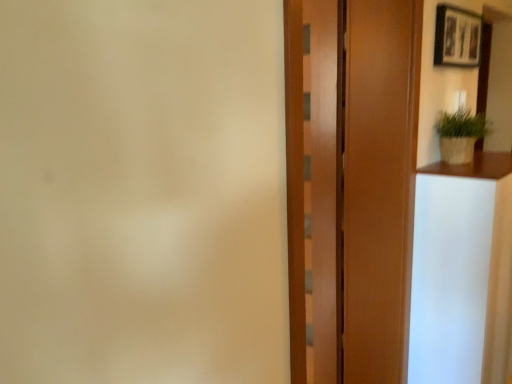
Measure the distance between point (475, 55) and camera.

They are 6.99 feet apart.

You are a GUI agent. You are given a task and a screenshot of the screen. Output one action in this format:
    pyautogui.click(x=<x>, y=<y>)
    Task: Click on the green woven basket at upper right
    This screenshot has width=512, height=384.
    Given the screenshot: What is the action you would take?
    pyautogui.click(x=460, y=135)

Describe the element at coordinates (462, 272) in the screenshot. I see `white glossy vanity at right` at that location.

Measure the distance between wooden barn door at center and camera.

wooden barn door at center is 6.10 feet away from camera.

The height and width of the screenshot is (384, 512). In order to click on wooden picture frame at upper right in this screenshot , I will do `click(457, 37)`.

Is green woven basket at upper right smaller than wooden barn door at center?

Correct, green woven basket at upper right occupies less space than wooden barn door at center.

Is green woven basket at upper right touching wooden barn door at center?

No, green woven basket at upper right is not beside wooden barn door at center.

You are a GUI agent. You are given a task and a screenshot of the screen. Output one action in this format:
    pyautogui.click(x=<x>, y=<y>)
    Task: Click on the barn door to the left of green woven basket at upper right
    The width and height of the screenshot is (512, 384).
    Given the screenshot: What is the action you would take?
    pyautogui.click(x=313, y=185)

From the image's perspective, who appears lower, wooden barn door at center or wooden picture frame at upper right?

From the image's view, wooden barn door at center is below.

Is wooden barn door at center facing towards wooden picture frame at upper right?

No.

Considering the sizes of objects wooden barn door at center and wooden picture frame at upper right in the image provided, who is thinner, wooden barn door at center or wooden picture frame at upper right?

Thinner between the two is wooden barn door at center.

From a real-world perspective, is wooden barn door at center below wooden picture frame at upper right?

Yes.

Is white glossy vanity at right completely or partially outside of wooden door at center?

Yes.

This screenshot has width=512, height=384. What are the coordinates of `vanity that is behind the wooden door at center` in the screenshot? It's located at (462, 272).

Between white glossy vanity at right and wooden door at center, which one has larger width?

With larger width is white glossy vanity at right.

Is white glossy vanity at right beside wooden door at center?

No, white glossy vanity at right is not next to wooden door at center.

Between point (484, 221) and point (474, 51), which one is positioned in front?

Point (484, 221)

Does white glossy vanity at right have a greater width compared to wooden picture frame at upper right?

Yes, white glossy vanity at right is wider than wooden picture frame at upper right.

Does white glossy vanity at right have a greater height compared to wooden picture frame at upper right?

Correct, white glossy vanity at right is much taller as wooden picture frame at upper right.

Identify the location of vanity on the right of wooden picture frame at upper right. The image size is (512, 384). (462, 272).

Considering the relative positions of wooden picture frame at upper right and white glossy vanity at right in the image provided, is wooden picture frame at upper right to the left or to the right of white glossy vanity at right?

wooden picture frame at upper right is positioned on white glossy vanity at right's left side.

Is wooden picture frame at upper right taller or shorter than white glossy vanity at right?

Clearly, wooden picture frame at upper right is shorter compared to white glossy vanity at right.

Which object is more forward, wooden picture frame at upper right or white glossy vanity at right?

white glossy vanity at right is more forward.

Considering the positions of point (468, 22) and point (468, 220), is point (468, 22) closer or farther from the camera than point (468, 220)?

Point (468, 22).

Is green woven basket at upper right wider than wooden picture frame at upper right?

Yes.

From the image's perspective, is green woven basket at upper right above or below wooden picture frame at upper right?

Clearly, from the image's perspective, green woven basket at upper right is below wooden picture frame at upper right.

Is green woven basket at upper right oriented towards wooden picture frame at upper right?

No, green woven basket at upper right is not aimed at wooden picture frame at upper right.

Is green woven basket at upper right next to wooden picture frame at upper right and touching it?

They are not placed beside each other.

Does white glossy vanity at right come in front of wooden barn door at center?

No, white glossy vanity at right is further to the viewer.

From the image's perspective, which object appears higher, white glossy vanity at right or wooden barn door at center?

wooden barn door at center appears higher in the image.

Is white glossy vanity at right bigger than wooden barn door at center?

Indeed, white glossy vanity at right has a larger size compared to wooden barn door at center.

From the picture: How different are the orientations of white glossy vanity at right and wooden barn door at center in degrees?

They differ by 0.717 degrees in their facing directions.

Find the location of a particular element. barn door in front of the green woven basket at upper right is located at coordinates (313, 185).

What are the coordinates of `picture frame on the right of wooden barn door at center` in the screenshot? It's located at (457, 37).

Based on the photo, looking at the image, which one is located further to wooden barn door at center, green woven basket at upper right or wooden door at center?

green woven basket at upper right is further to wooden barn door at center.

From the image, which object appears to be nearer to white glossy vanity at right, green woven basket at upper right or wooden picture frame at upper right?

Based on the image, green woven basket at upper right appears to be nearer to white glossy vanity at right.

Based on their spatial positions, is white glossy vanity at right or green woven basket at upper right closer to wooden picture frame at upper right?

Based on the image, green woven basket at upper right appears to be nearer to wooden picture frame at upper right.

When comparing their distances from wooden barn door at center, does white glossy vanity at right or wooden picture frame at upper right seem closer?

The object closer to wooden barn door at center is white glossy vanity at right.

When comparing their distances from wooden picture frame at upper right, does wooden door at center or white glossy vanity at right seem closer?

wooden door at center.

From the picture: Which object lies further to the anchor point green woven basket at upper right, wooden picture frame at upper right or white glossy vanity at right?

Based on the image, white glossy vanity at right appears to be further to green woven basket at upper right.

Estimate the real-world distances between objects in this image. Which object is closer to green woven basket at upper right, wooden barn door at center or wooden picture frame at upper right?

The object closer to green woven basket at upper right is wooden picture frame at upper right.

Looking at the image, which one is located closer to wooden door at center, wooden barn door at center or green woven basket at upper right?

wooden barn door at center.

The image size is (512, 384). I want to click on houseplant between wooden picture frame at upper right and wooden door at center in the vertical direction, so click(460, 135).

This screenshot has width=512, height=384. In order to click on barn door located between wooden door at center and green woven basket at upper right in the left-right direction in this screenshot , I will do pyautogui.click(x=313, y=185).

Identify the location of houseplant between wooden picture frame at upper right and white glossy vanity at right from top to bottom. This screenshot has height=384, width=512. (460, 135).

Where is `door between wooden picture frame at upper right and white glossy vanity at right in the up-down direction`? The height and width of the screenshot is (384, 512). door between wooden picture frame at upper right and white glossy vanity at right in the up-down direction is located at coordinates (350, 185).